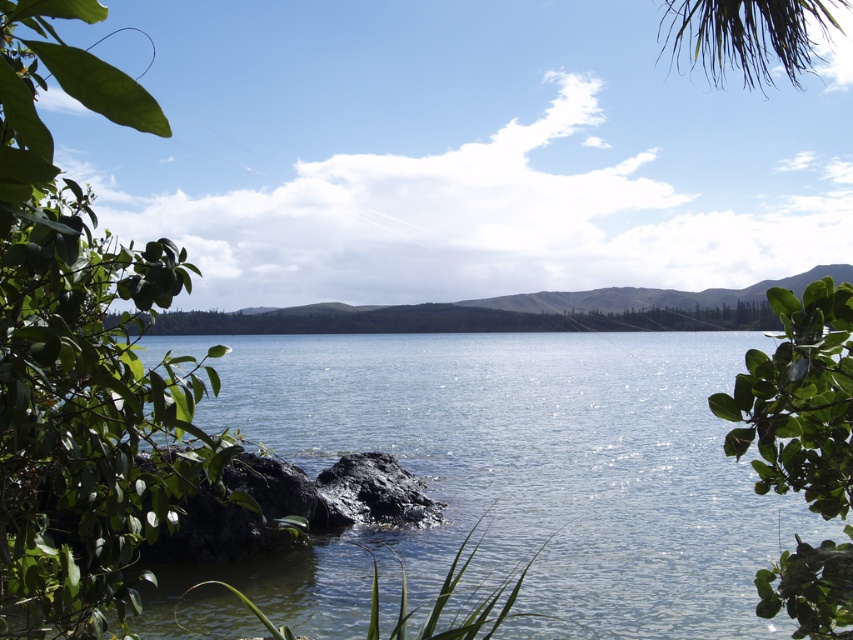
Question: Estimate the real-world distances between objects in this image. Which object is closer to the green leafy tree at center?

Choices:
 (A) clear water at center
 (B) green leafy tree at left

Answer: (B)

Question: Among these points, which one is nearest to the camera?

Choices:
 (A) (776, 572)
 (B) (28, 451)

Answer: (B)

Question: Does clear water at center have a smaller size compared to green leafy tree at left?

Choices:
 (A) no
 (B) yes

Answer: (A)

Question: Among these points, which one is nearest to the camera?

Choices:
 (A) (753, 412)
 (B) (639, 509)
 (C) (213, 435)

Answer: (A)

Question: Can you confirm if clear water at center is thinner than green leafy tree at left?

Choices:
 (A) yes
 (B) no

Answer: (B)

Question: Considering the relative positions of green leafy tree at left and green leafy tree at center in the image provided, where is green leafy tree at left located with respect to green leafy tree at center?

Choices:
 (A) below
 (B) above

Answer: (B)